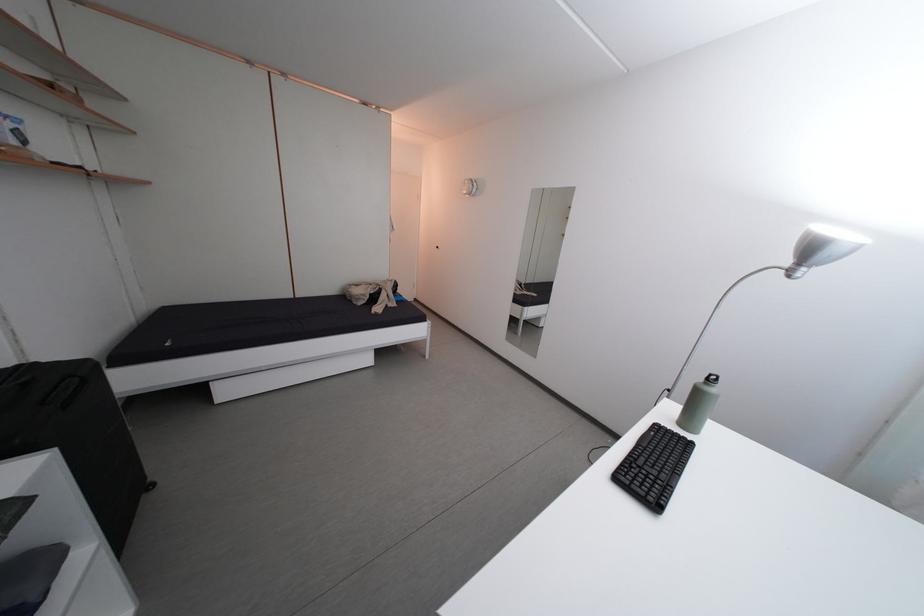
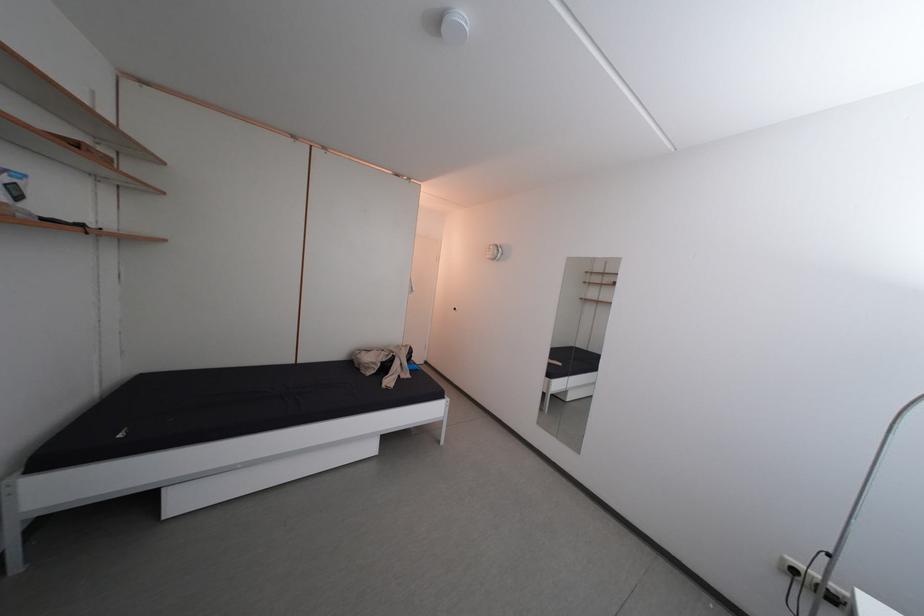
Question: The images are taken continuously from a first-person perspective. In which direction is your viewpoint rotating?

Choices:
 (A) Left
 (B) Right
 (C) Up
 (D) Down

Answer: (C)